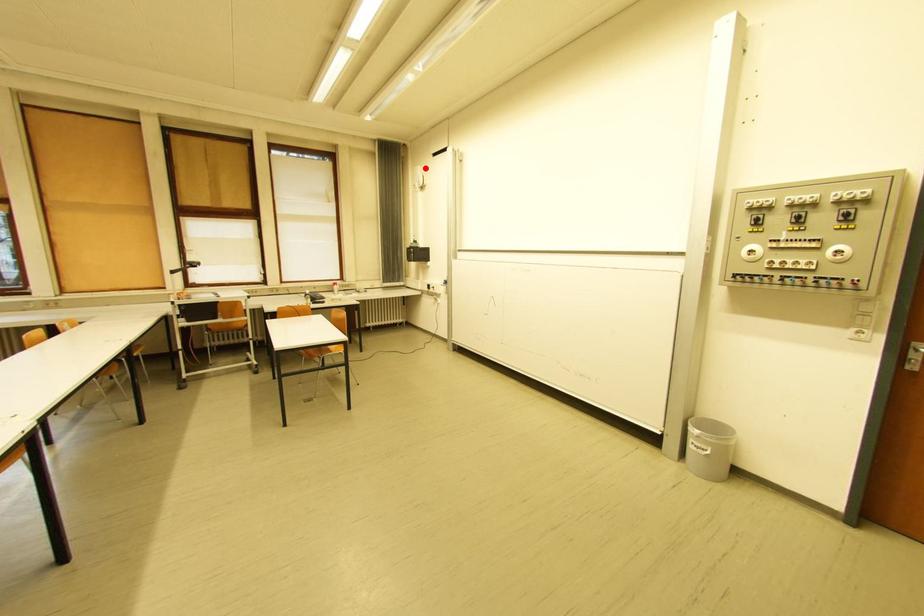
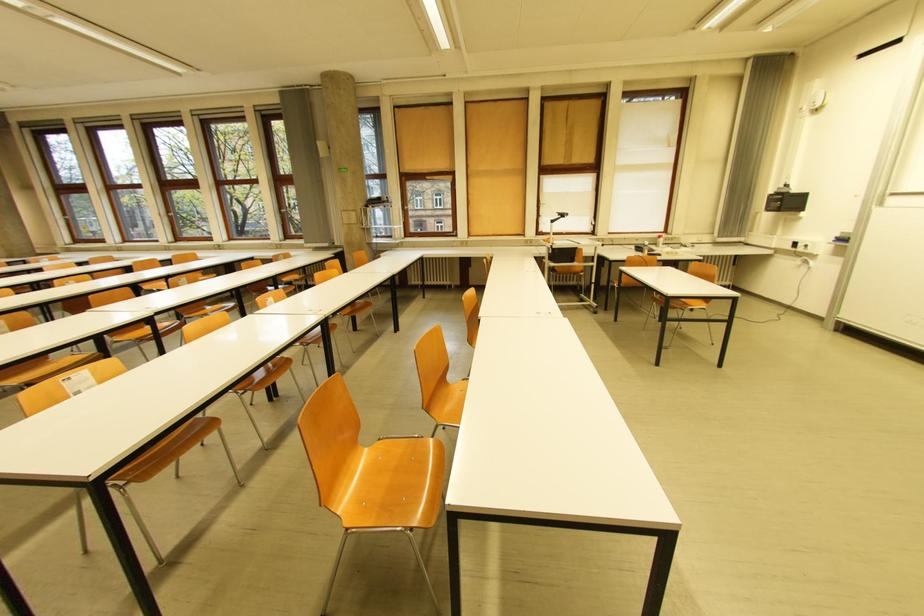
The point at the highlighted location is marked in the first image. Where is the corresponding point in the second image?

(823, 82)